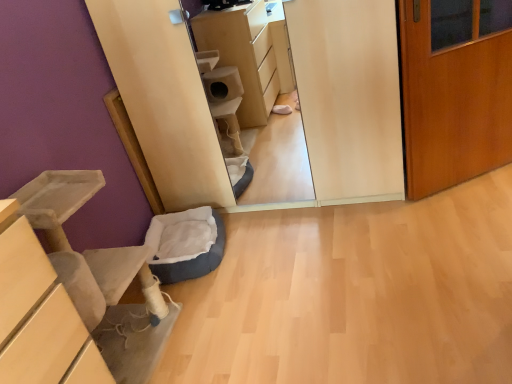
Question: From a real-world perspective, is wooden door at right located beneath dark blue plush cat bed at lower left?

Choices:
 (A) no
 (B) yes

Answer: (A)

Question: From the image's perspective, does wooden door at right appear higher than dark blue plush cat bed at lower left?

Choices:
 (A) yes
 (B) no

Answer: (A)

Question: From a real-world perspective, is wooden door at right on dark blue plush cat bed at lower left?

Choices:
 (A) no
 (B) yes

Answer: (B)

Question: Is wooden door at right closer to the viewer compared to dark blue plush cat bed at lower left?

Choices:
 (A) yes
 (B) no

Answer: (A)

Question: Considering the relative sizes of wooden door at right and dark blue plush cat bed at lower left in the image provided, is wooden door at right wider than dark blue plush cat bed at lower left?

Choices:
 (A) yes
 (B) no

Answer: (B)

Question: Is wooden door at right positioned behind dark blue plush cat bed at lower left?

Choices:
 (A) yes
 (B) no

Answer: (B)

Question: Is soft gray cat bed at lower left thinner than dark blue plush cat bed at lower left?

Choices:
 (A) yes
 (B) no

Answer: (A)

Question: Is soft gray cat bed at lower left looking in the opposite direction of dark blue plush cat bed at lower left?

Choices:
 (A) yes
 (B) no

Answer: (B)

Question: Can you confirm if soft gray cat bed at lower left is positioned to the right of dark blue plush cat bed at lower left?

Choices:
 (A) yes
 (B) no

Answer: (B)

Question: Does soft gray cat bed at lower left have a smaller size compared to dark blue plush cat bed at lower left?

Choices:
 (A) yes
 (B) no

Answer: (B)

Question: From a real-world perspective, is soft gray cat bed at lower left over dark blue plush cat bed at lower left?

Choices:
 (A) no
 (B) yes

Answer: (B)

Question: Is there a large distance between soft gray cat bed at lower left and dark blue plush cat bed at lower left?

Choices:
 (A) yes
 (B) no

Answer: (B)

Question: Does dark blue plush cat bed at lower left appear on the left side of soft gray cat bed at lower left?

Choices:
 (A) yes
 (B) no

Answer: (B)